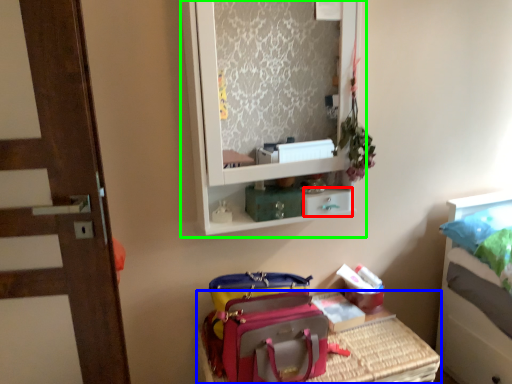
Question: Estimate the real-world distances between objects in this image. Which object is farther from drawer (highlighted by a red box), furniture (highlighted by a blue box) or medicine cabinet (highlighted by a green box)?

Choices:
 (A) furniture
 (B) medicine cabinet

Answer: (B)